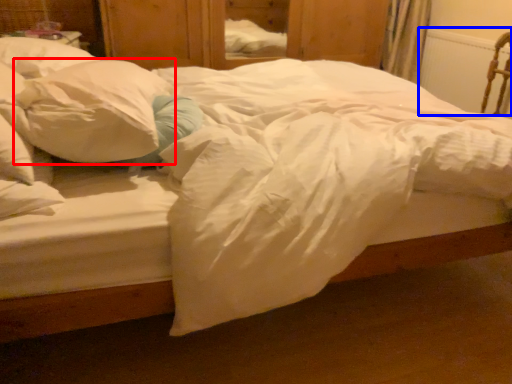
Question: Which object appears closest to the camera in this image, pillow (highlighted by a red box) or radiator (highlighted by a blue box)?

Choices:
 (A) pillow
 (B) radiator

Answer: (A)